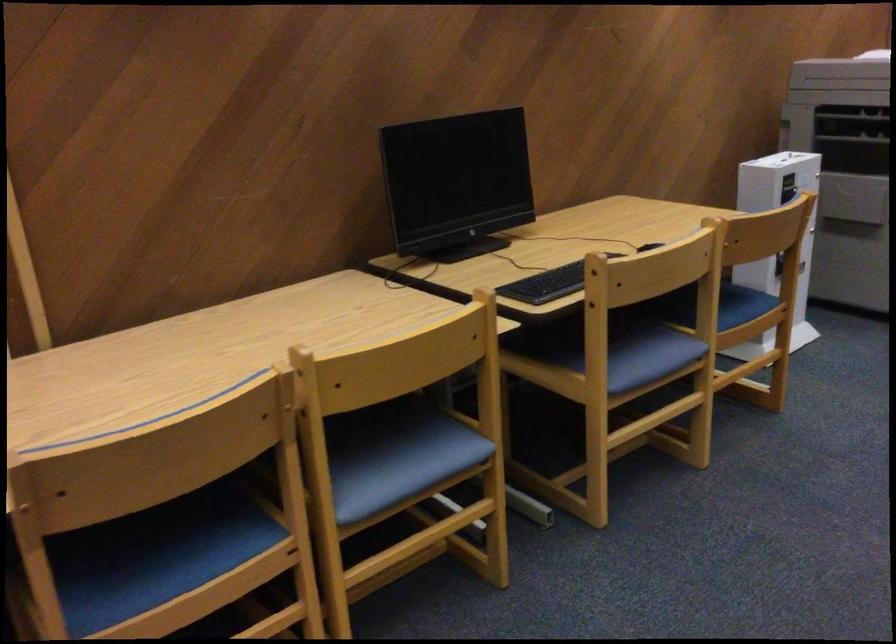
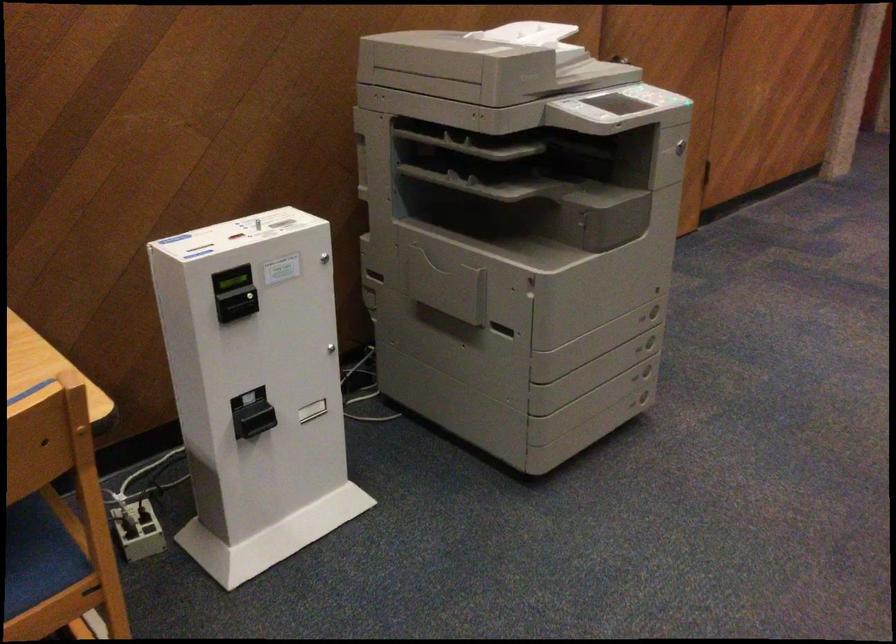
In the scene shown: The images are taken continuously from a first-person perspective. In which direction are you moving?

The cameraman moved toward right, forward.